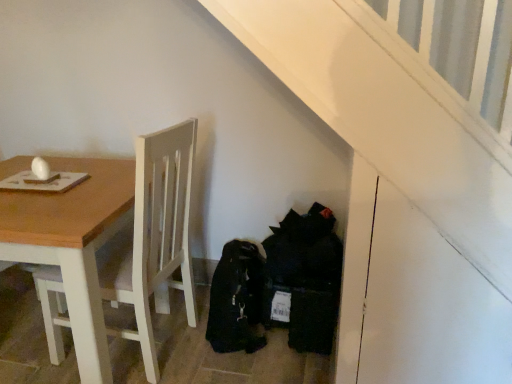
What do you see at coordinates (73, 244) in the screenshot? I see `wooden table at left` at bounding box center [73, 244].

Identify the location of wooden table at left. (73, 244).

Locate an element on the screen. This screenshot has width=512, height=384. wooden table at left is located at coordinates (73, 244).